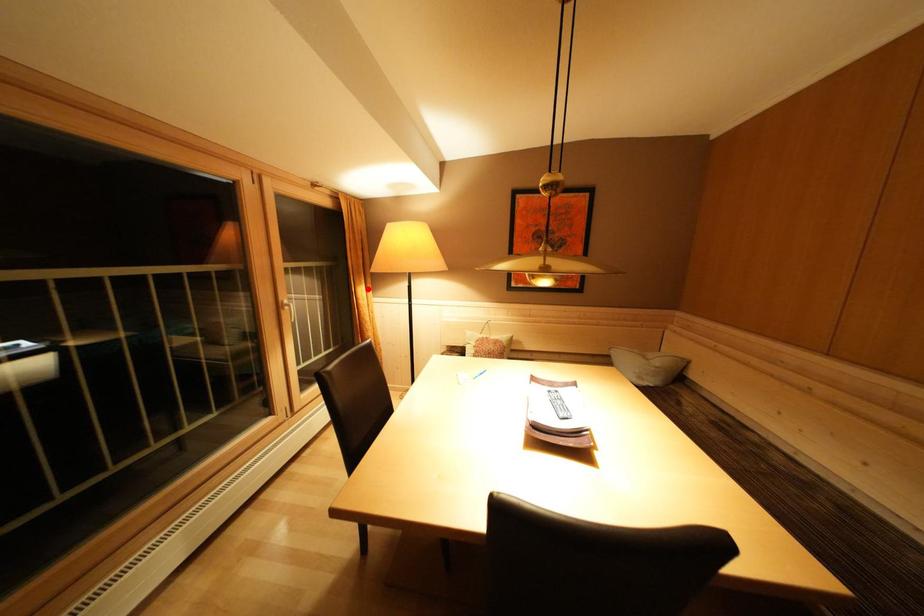
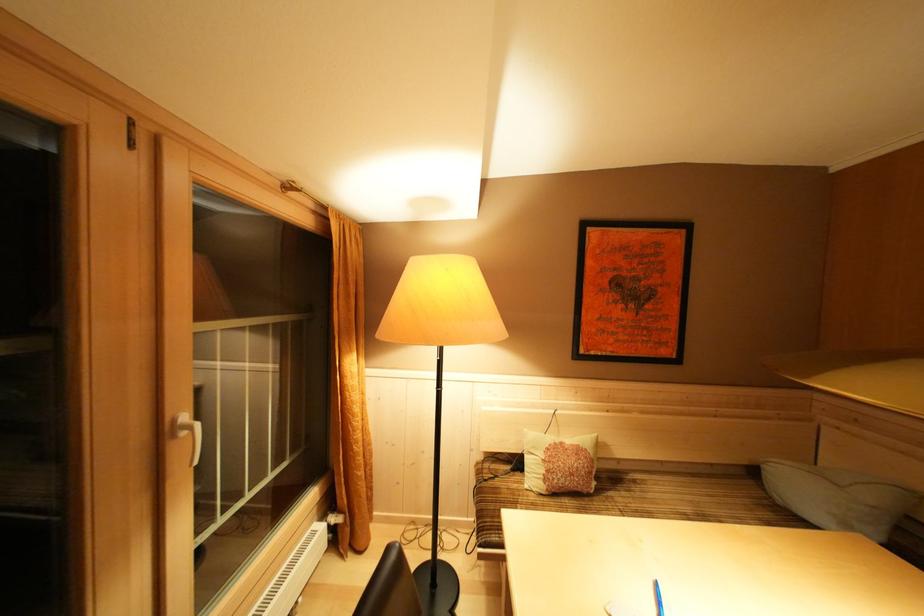
The point at the highlighted location is marked in the first image. Where is the corresponding point in the second image?

(358, 357)